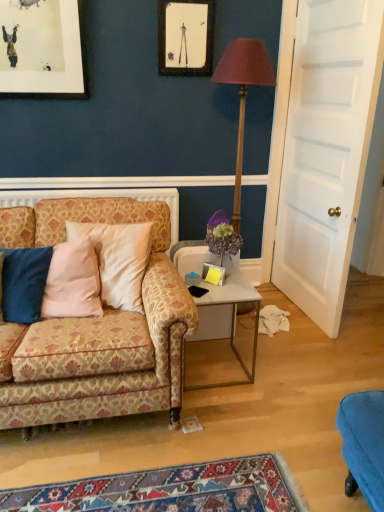
You are a GUI agent. You are given a task and a screenshot of the screen. Output one action in this format:
    pyautogui.click(x=<x>, y=<y>)
    Task: Click on the vacant space in front of white wooden door at right
    This screenshot has height=512, width=384.
    Given the screenshot: What is the action you would take?
    pyautogui.click(x=317, y=354)